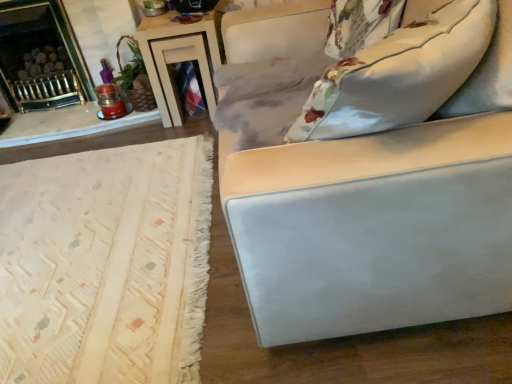
Question: Considering the relative sizes of brushed metal fireplace at upper left and floral fabric pillow at upper right in the image provided, is brushed metal fireplace at upper left thinner than floral fabric pillow at upper right?

Choices:
 (A) no
 (B) yes

Answer: (A)

Question: Is the depth of brushed metal fireplace at upper left less than that of floral fabric pillow at upper right?

Choices:
 (A) yes
 (B) no

Answer: (B)

Question: Are brushed metal fireplace at upper left and floral fabric pillow at upper right far apart?

Choices:
 (A) no
 (B) yes

Answer: (B)

Question: Can you confirm if brushed metal fireplace at upper left is taller than floral fabric pillow at upper right?

Choices:
 (A) yes
 (B) no

Answer: (A)

Question: Is brushed metal fireplace at upper left with floral fabric pillow at upper right?

Choices:
 (A) no
 (B) yes

Answer: (A)

Question: Looking at the image, does wooden table at upper center seem bigger or smaller compared to brushed metal fireplace at upper left?

Choices:
 (A) big
 (B) small

Answer: (B)

Question: Is point [x=184, y=51] positioned closer to the camera than point [x=51, y=34]?

Choices:
 (A) closer
 (B) farther

Answer: (A)

Question: Considering their positions, is wooden table at upper center located in front of or behind brushed metal fireplace at upper left?

Choices:
 (A) front
 (B) behind

Answer: (A)

Question: Is wooden table at upper center inside the boundaries of brushed metal fireplace at upper left, or outside?

Choices:
 (A) inside
 (B) outside

Answer: (B)

Question: Based on their sizes in the image, would you say brushed metal fireplace at upper left is bigger or smaller than floral fabric pillow at upper right?

Choices:
 (A) small
 (B) big

Answer: (B)

Question: From a real-world perspective, is brushed metal fireplace at upper left physically located above or below floral fabric pillow at upper right?

Choices:
 (A) below
 (B) above

Answer: (A)

Question: Based on their positions, is brushed metal fireplace at upper left located to the left or right of floral fabric pillow at upper right?

Choices:
 (A) right
 (B) left

Answer: (B)

Question: In terms of height, does brushed metal fireplace at upper left look taller or shorter compared to floral fabric pillow at upper right?

Choices:
 (A) tall
 (B) short

Answer: (A)

Question: Considering the positions of floral fabric pillow at upper right and wooden table at upper center in the image, is floral fabric pillow at upper right taller or shorter than wooden table at upper center?

Choices:
 (A) tall
 (B) short

Answer: (B)

Question: Does point (360, 117) appear closer or farther from the camera than point (197, 56)?

Choices:
 (A) closer
 (B) farther

Answer: (A)